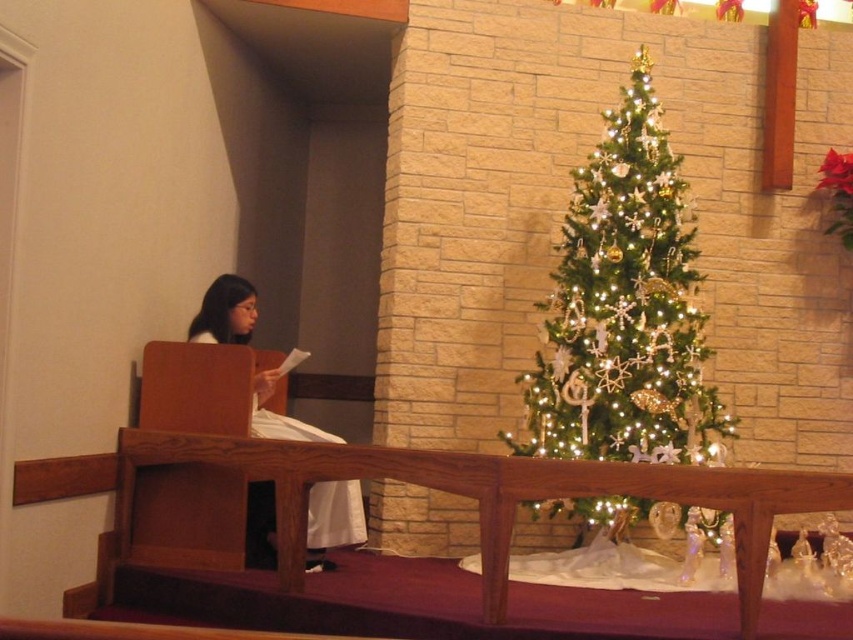
Question: Can you confirm if iridescent gold christmas tree at center is positioned above white fabric at left?

Choices:
 (A) yes
 (B) no

Answer: (A)

Question: Can you confirm if iridescent gold christmas tree at center is positioned below white fabric at left?

Choices:
 (A) no
 (B) yes

Answer: (A)

Question: Is iridescent gold christmas tree at center below white fabric at left?

Choices:
 (A) no
 (B) yes

Answer: (A)

Question: Which object appears closest to the camera in this image?

Choices:
 (A) white fabric at left
 (B) iridescent gold christmas tree at center

Answer: (A)